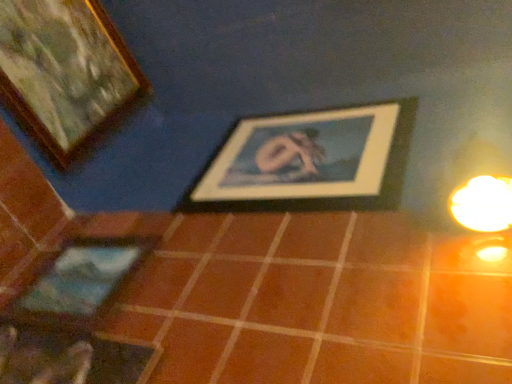
Question: Is wooden framed picture at center, which is the third picture frame from left to right, to the left of wooden picture frame at upper left, the 3th picture frame in the bottom-to-top sequence, from the viewer's perspective?

Choices:
 (A) yes
 (B) no

Answer: (B)

Question: From the image's perspective, is wooden framed picture at center, which is the third picture frame from left to right, located above wooden picture frame at upper left, which is the first picture frame from top to bottom?

Choices:
 (A) yes
 (B) no

Answer: (B)

Question: Are wooden framed picture at center, which is the third picture frame from left to right, and wooden picture frame at upper left, the 3th picture frame in the bottom-to-top sequence, located far from each other?

Choices:
 (A) no
 (B) yes

Answer: (A)

Question: Would you say wooden picture frame at upper left, the 3th picture frame in the bottom-to-top sequence, is part of wooden framed picture at center, the 2th picture frame positioned from the top,'s contents?

Choices:
 (A) yes
 (B) no

Answer: (B)

Question: Considering the relative sizes of wooden framed picture at center, which is the third picture frame from left to right, and wooden picture frame at upper left, which ranks as the first picture frame in left-to-right order, in the image provided, is wooden framed picture at center, which is the third picture frame from left to right, wider than wooden picture frame at upper left, which ranks as the first picture frame in left-to-right order,?

Choices:
 (A) yes
 (B) no

Answer: (B)

Question: Considering the positions of matte blue picture frame at lower left, which appears as the 1th picture frame when ordered from the bottom, and wooden framed picture at center, the 2th picture frame positioned from the top, in the image, is matte blue picture frame at lower left, which appears as the 1th picture frame when ordered from the bottom, wider or thinner than wooden framed picture at center, the 2th picture frame positioned from the top,?

Choices:
 (A) wide
 (B) thin

Answer: (B)

Question: Considering their positions, is matte blue picture frame at lower left, positioned as the 3th picture frame in top-to-bottom order, located in front of or behind wooden framed picture at center, which appears as the 1th picture frame when viewed from the right?

Choices:
 (A) front
 (B) behind

Answer: (A)

Question: Does point (101, 312) appear closer or farther from the camera than point (344, 182)?

Choices:
 (A) farther
 (B) closer

Answer: (B)

Question: Do you think matte blue picture frame at lower left, positioned as the 3th picture frame in top-to-bottom order, is within wooden framed picture at center, the 2th picture frame positioned from the bottom, or outside of it?

Choices:
 (A) inside
 (B) outside

Answer: (B)

Question: Does point (113, 240) appear closer or farther from the camera than point (244, 364)?

Choices:
 (A) closer
 (B) farther

Answer: (B)

Question: Is matte blue picture frame at lower left, which appears as the 1th picture frame when ordered from the bottom, in front of or behind brown matte tile at center in the image?

Choices:
 (A) behind
 (B) front

Answer: (A)

Question: Is matte blue picture frame at lower left, positioned as the 3th picture frame in top-to-bottom order, situated inside brown matte tile at center or outside?

Choices:
 (A) outside
 (B) inside

Answer: (A)

Question: From a real-world perspective, relative to brown matte tile at center, is matte blue picture frame at lower left, positioned as the 2th picture frame in left-to-right order, vertically above or below?

Choices:
 (A) below
 (B) above

Answer: (A)

Question: Is brown matte tile at center inside the boundaries of wooden picture frame at upper left, the 3th picture frame in the bottom-to-top sequence, or outside?

Choices:
 (A) outside
 (B) inside

Answer: (A)

Question: Is brown matte tile at center in front of or behind wooden picture frame at upper left, which is the first picture frame from top to bottom, in the image?

Choices:
 (A) behind
 (B) front

Answer: (B)